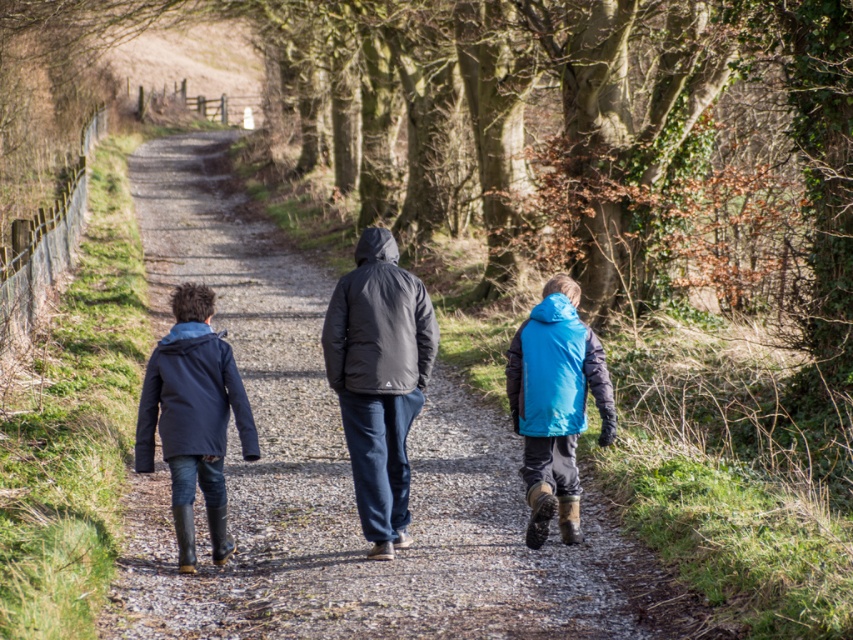
Question: Which point is farther to the camera?

Choices:
 (A) tap(170, 163)
 (B) tap(554, 360)
 (C) tap(358, 384)

Answer: (A)

Question: Does dark gray puffer jacket at center have a smaller size compared to blue synthetic jacket at lower right?

Choices:
 (A) no
 (B) yes

Answer: (A)

Question: Is matte black jacket at center positioned in front of dark gray puffer jacket at center?

Choices:
 (A) yes
 (B) no

Answer: (A)

Question: Considering the real-world distances, which object is farthest from the dark gray puffer jacket at center?

Choices:
 (A) matte black jacket at center
 (B) blue synthetic jacket at lower right
 (C) matte blue jacket at left

Answer: (A)

Question: Does dark gray puffer jacket at center appear on the right side of blue synthetic jacket at lower right?

Choices:
 (A) no
 (B) yes

Answer: (A)

Question: Considering the real-world distances, which object is closest to the blue synthetic jacket at lower right?

Choices:
 (A) matte blue jacket at left
 (B) matte black jacket at center
 (C) dark gray puffer jacket at center

Answer: (C)